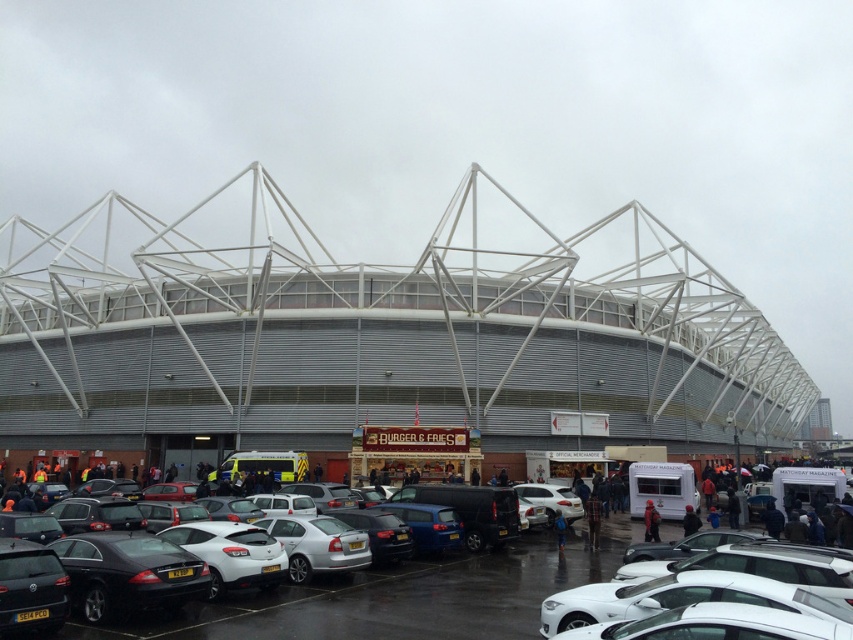
You are a delivery driver who needs to park your truck between the black glossy sedan at lower left and the white matte car at center. The truck requires a minimum space of 35 meters. Can you fit your truck between them?

The black glossy sedan at lower left is 34.55 meters from the white matte car at center, so the distance is insufficient. The truck cannot fit between them as it requires at least 35 meters.

From the picture: You are a parking attendant and need to fit both the matte black car at lower left and the white matte car at center into a single parking space. Given their sizes, which car should you move first to ensure they both fit?

The matte black car at lower left has a smaller size compared to the white matte car at center. Therefore, you should move the matte black car at lower left first, as its smaller size allows it to be positioned in a way that accommodates both vehicles within the space.